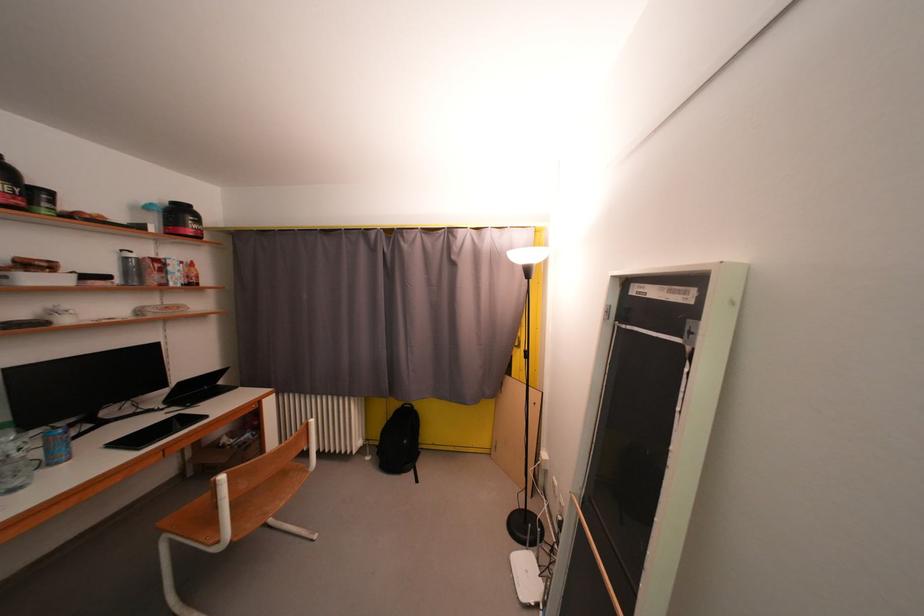
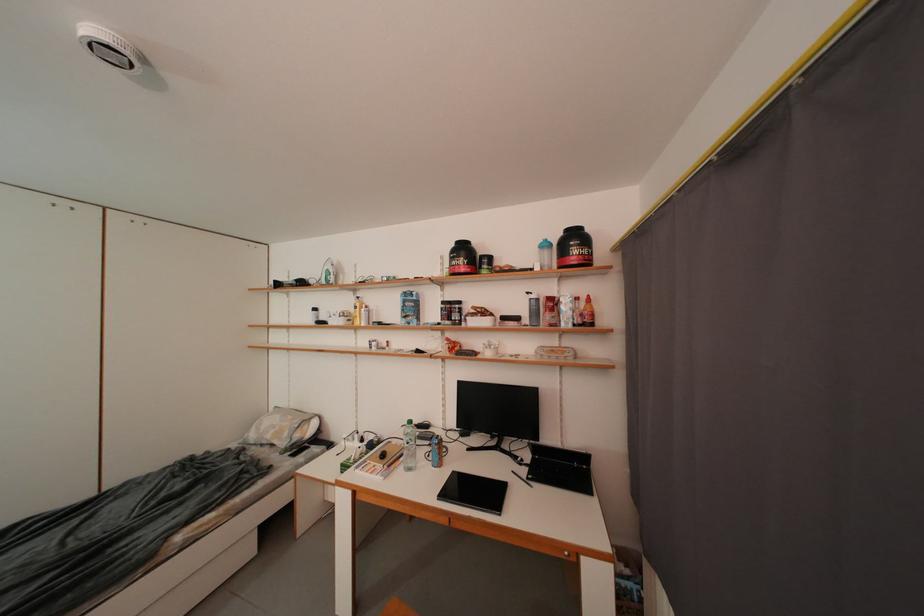
Where in the second image is the point corresponding to (201,229) from the first image?

(582, 254)